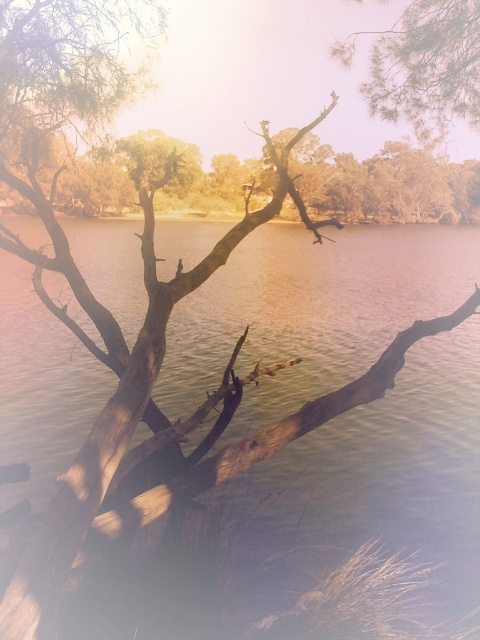
Is brown matte water at center further to the viewer compared to green textured pine branch at upper right?

No, brown matte water at center is closer to the viewer.

Who is positioned more to the left, brown matte water at center or green textured pine branch at upper right?

Positioned to the left is green textured pine branch at upper right.

Which is in front, point (470, 540) or point (392, 97)?

Point (470, 540)

This screenshot has height=640, width=480. I want to click on brown matte water at center, so click(316, 513).